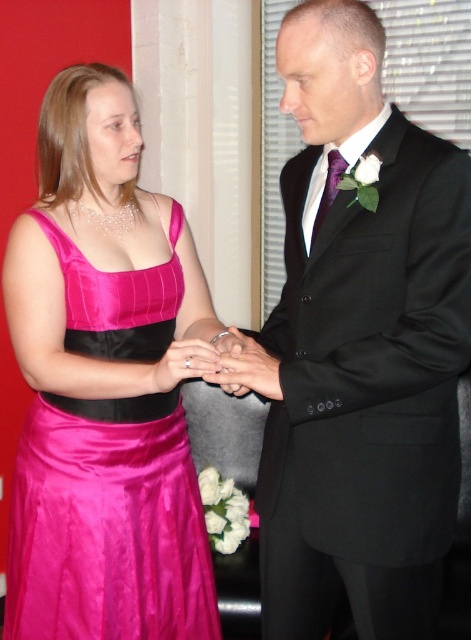
Consider the image. You are a photographer at this event. You need to adjust your camera focus to capture both the matte black ring at center and the satin pink dress at center clearly. Considering their sizes, which object should you focus on first to ensure proper depth of field?

The matte black ring at center is much taller than the satin pink dress at center, so you should focus on the matte black ring at center first to ensure proper depth of field.

You are a photographer at the event and want to capture a photo where both the shiny pink dress at left and the satin pink dress at center are visible. Given their heights, which dress will appear taller in the photo?

The shiny pink dress at left will appear taller in the photo because it has a greater height compared to the satin pink dress at center.

You are a photographer at a wedding ceremony. You need to capture a closeup shot of the matte black ring at center and the satin pink dress at center. Based on their positions, which object should you focus on first to ensure both are in focus?

The matte black ring at center is in front of the satin pink dress at center. To ensure both are in focus, you should focus on the matte black ring at center first since it is closer to the camera.